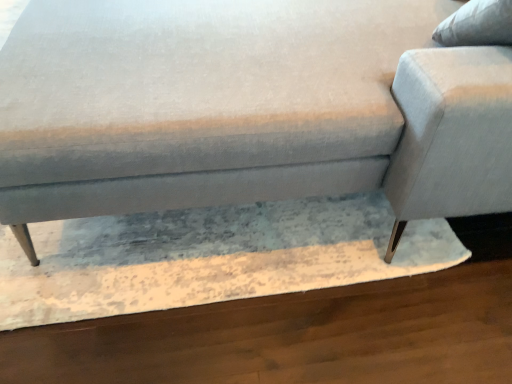
Question: Is textured fabric couch at center at the back of light gray fabric swivel chair at upper right?

Choices:
 (A) yes
 (B) no

Answer: (A)

Question: From the image's perspective, is light gray fabric swivel chair at upper right under textured fabric couch at center?

Choices:
 (A) no
 (B) yes

Answer: (B)

Question: Is light gray fabric swivel chair at upper right with textured fabric couch at center?

Choices:
 (A) yes
 (B) no

Answer: (B)

Question: Is the position of light gray fabric swivel chair at upper right more distant than that of textured fabric couch at center?

Choices:
 (A) no
 (B) yes

Answer: (B)

Question: Does light gray fabric swivel chair at upper right appear on the right side of textured fabric couch at center?

Choices:
 (A) no
 (B) yes

Answer: (B)

Question: Would you consider light gray fabric swivel chair at upper right to be distant from textured fabric couch at center?

Choices:
 (A) no
 (B) yes

Answer: (A)

Question: Is textured fabric couch at center smaller than light gray fabric swivel chair at upper right?

Choices:
 (A) no
 (B) yes

Answer: (A)

Question: Is textured fabric couch at center far from light gray fabric swivel chair at upper right?

Choices:
 (A) no
 (B) yes

Answer: (A)

Question: Is textured fabric couch at center shorter than light gray fabric swivel chair at upper right?

Choices:
 (A) yes
 (B) no

Answer: (B)

Question: From a real-world perspective, is textured fabric couch at center below light gray fabric swivel chair at upper right?

Choices:
 (A) yes
 (B) no

Answer: (A)

Question: Is textured fabric couch at center outside light gray fabric swivel chair at upper right?

Choices:
 (A) no
 (B) yes

Answer: (B)

Question: Does textured fabric couch at center have a larger size compared to light gray fabric swivel chair at upper right?

Choices:
 (A) no
 (B) yes

Answer: (B)

Question: From a real-world perspective, is light gray fabric swivel chair at upper right physically located above or below textured fabric couch at center?

Choices:
 (A) above
 (B) below

Answer: (A)